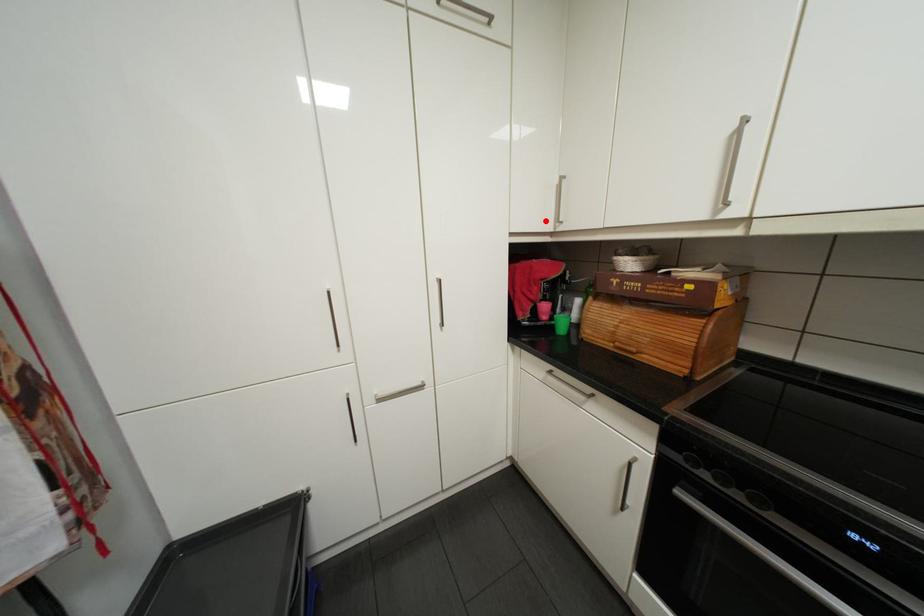
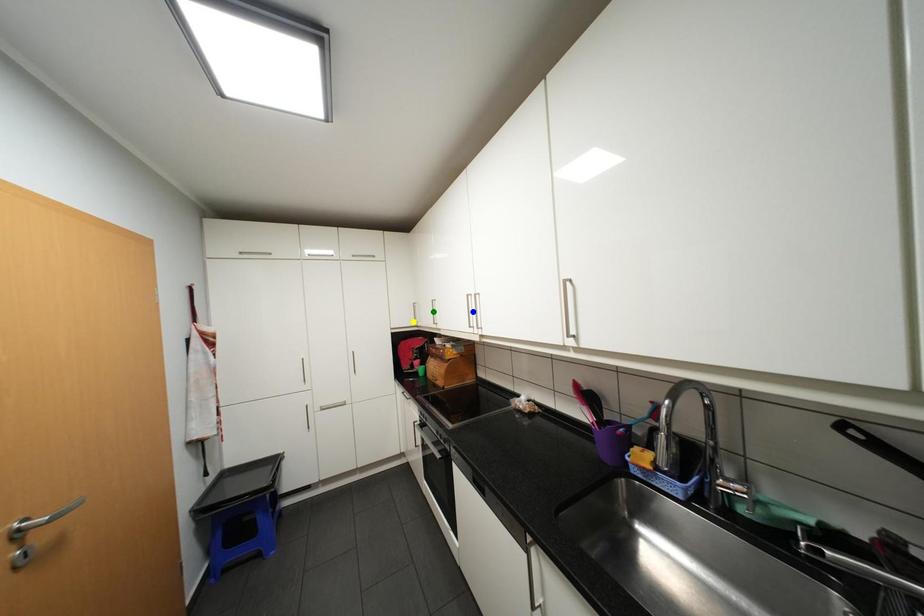
Question: I am providing you with two images of the same scene from different viewpoints. A red point is marked on the first image. You are given multiple points on the second image. In image 2, which mark is for the same physical point as the one in image 1?

Choices:
 (A) yellow point
 (B) blue point
 (C) green point

Answer: (A)